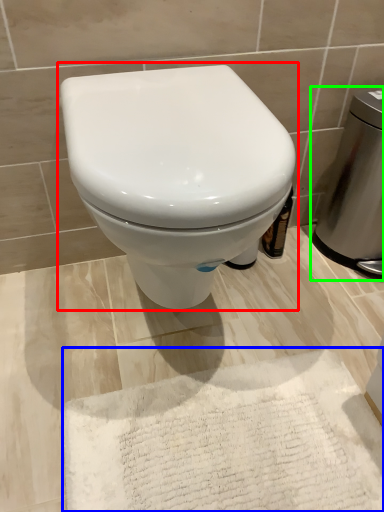
Question: Which is farther away from toilet (highlighted by a red box)? bath mat (highlighted by a blue box) or appliance (highlighted by a green box)?

Choices:
 (A) bath mat
 (B) appliance

Answer: (B)